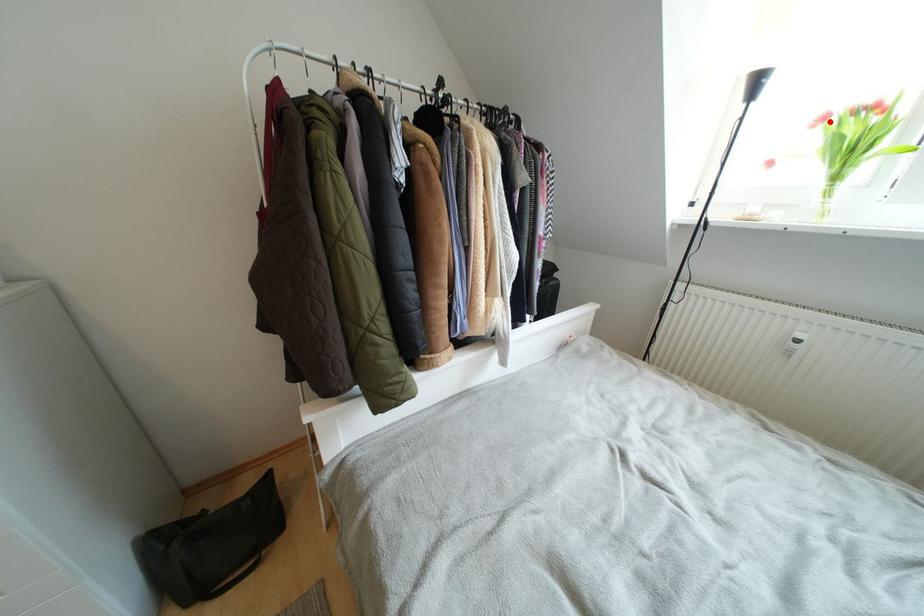
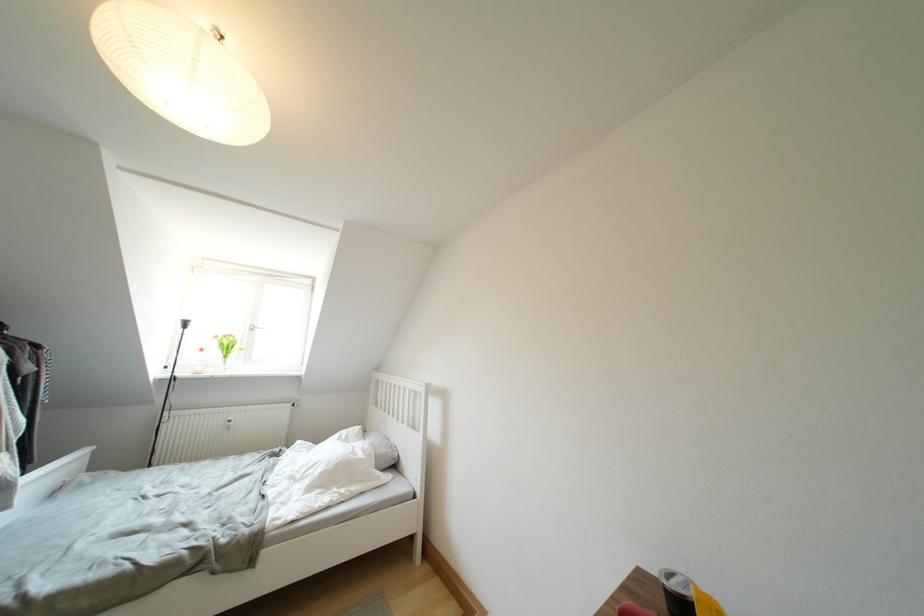
The point at the highlighted location is marked in the first image. Where is the corresponding point in the second image?

(222, 341)